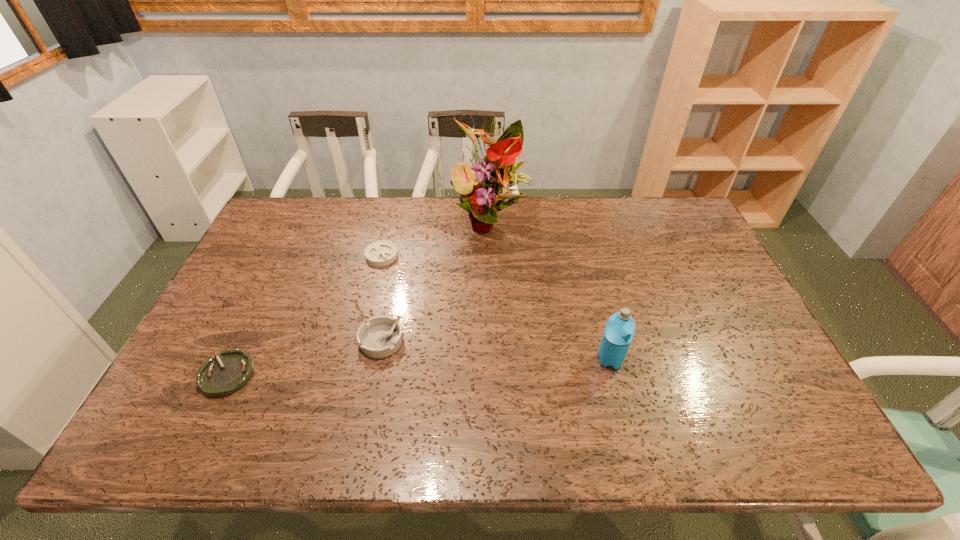
Find the location of a particular element. free point located on the back of the farthest ashtray is located at coordinates (390, 223).

At what (x,y) coordinates should I click in order to perform the action: click on vacant space situated 0.240m on the back of the leftmost object. Please return your answer as a coordinate pair (x, y). The image size is (960, 540). Looking at the image, I should click on (270, 287).

Find the location of a particular element. This screenshot has width=960, height=540. object at the far edge is located at coordinates (491, 177).

The image size is (960, 540). In order to click on object that is at the left edge in this screenshot , I will do `click(220, 376)`.

The image size is (960, 540). What are the coordinates of `free region at the far edge` in the screenshot? It's located at (458, 197).

The image size is (960, 540). In the image, there is a desktop. What are the coordinates of `vacant space at the near edge` in the screenshot? It's located at pos(540,434).

The image size is (960, 540). Identify the location of vacant space at the left edge. (196, 345).

This screenshot has height=540, width=960. Find the location of `blank space at the right edge of the desktop`. blank space at the right edge of the desktop is located at coordinates (688, 286).

In the image, there is a desktop. Identify the location of vacant space at the far left corner. This screenshot has height=540, width=960. (281, 202).

Where is `vacant area between the fourth shortest object and the leftmost object`? The height and width of the screenshot is (540, 960). vacant area between the fourth shortest object and the leftmost object is located at coordinates (419, 367).